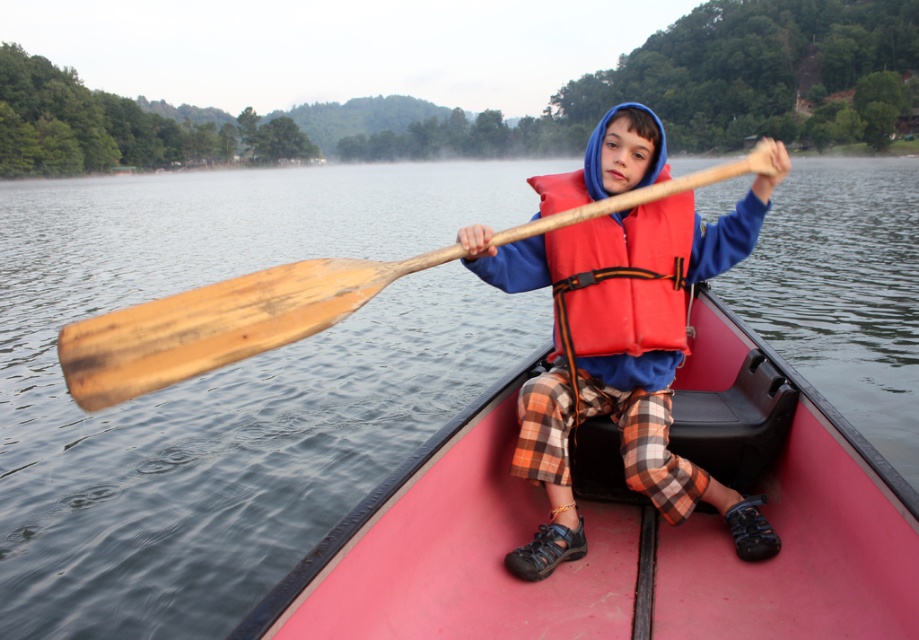
Where is `matte orange life vest at center`? matte orange life vest at center is located at coordinates (621, 356).

Is point (512, 248) positioned behind point (576, 288)?

Yes, it is.

The width and height of the screenshot is (919, 640). What do you see at coordinates (621, 356) in the screenshot?
I see `matte orange life vest at center` at bounding box center [621, 356].

Locate an element on the screen. The image size is (919, 640). matte orange life vest at center is located at coordinates (621, 356).

Can you confirm if matte orange life vest at center is positioned to the left of wooden paddle at center?

No, matte orange life vest at center is not to the left of wooden paddle at center.

Between matte orange life vest at center and wooden paddle at center, which one is positioned lower?

Positioned lower is matte orange life vest at center.

Between point (479, 236) and point (165, 369), which one is positioned in front?

Point (165, 369) is in front.

What are the coordinates of `matte orange life vest at center` in the screenshot? It's located at 621,356.

Measure the distance between wooden paddle at center and red life jacket at center.

A distance of 9.38 inches exists between wooden paddle at center and red life jacket at center.

Is point (64, 340) positioned before point (618, 349)?

Yes, it is.

At what (x,y) coordinates should I click in order to perform the action: click on wooden paddle at center. Please return your answer as a coordinate pair (x, y). The height and width of the screenshot is (640, 919). Looking at the image, I should click on (219, 323).